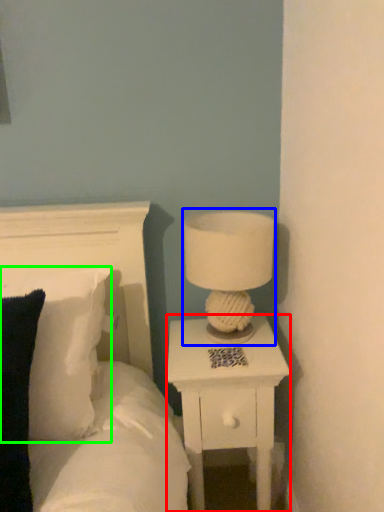
Question: Estimate the real-world distances between objects in this image. Which object is closer to nightstand (highlighted by a red box), table lamp (highlighted by a blue box) or pillow (highlighted by a green box)?

Choices:
 (A) table lamp
 (B) pillow

Answer: (A)